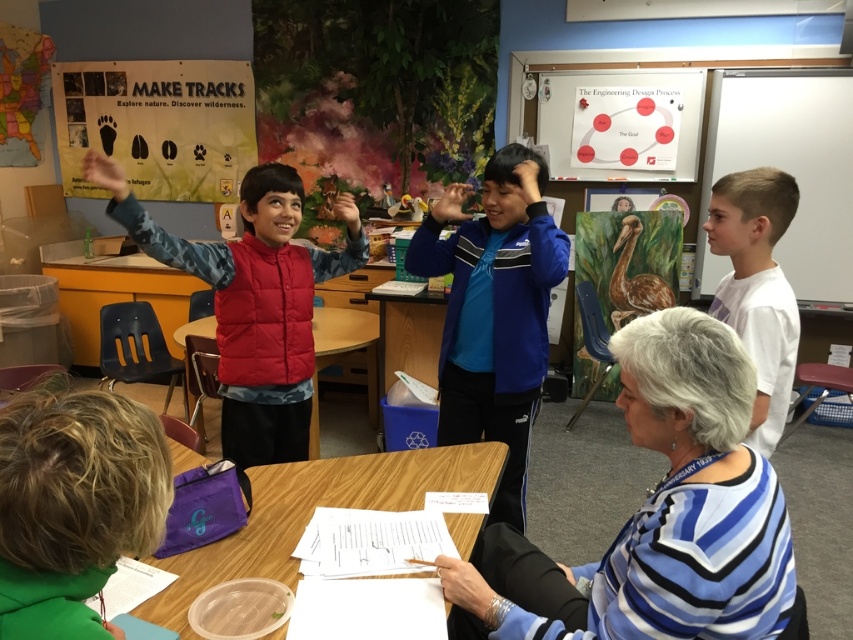
Question: Which of the following is the farthest from the observer?

Choices:
 (A) (759, 182)
 (B) (747, 77)
 (C) (457, 598)

Answer: (B)

Question: Can you confirm if blue fabric jacket at center is smaller than matte red hand at upper left?

Choices:
 (A) no
 (B) yes

Answer: (A)

Question: Is blue fabric jacket at center bigger than whiteboard at right?

Choices:
 (A) no
 (B) yes

Answer: (A)

Question: Estimate the real-world distances between objects in this image. Which object is farther from the white matte shirt at right?

Choices:
 (A) green fabric at lower left
 (B) matte red vest at left

Answer: (B)

Question: Among these objects, which one is farthest from the camera?

Choices:
 (A) smooth skin hand at center
 (B) white matte shirt at right
 (C) matte red vest at left
 (D) green fabric at lower left

Answer: (C)

Question: Observing the image, what is the correct spatial positioning of matte red vest at left in reference to matte red hand at upper left?

Choices:
 (A) below
 (B) above

Answer: (A)